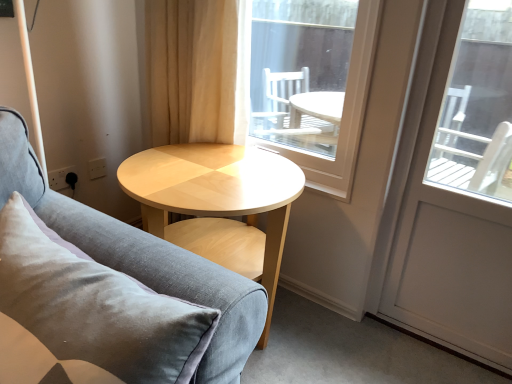
What do you see at coordinates (141, 257) in the screenshot? This screenshot has height=384, width=512. I see `velvet grey couch at center` at bounding box center [141, 257].

Locate an element on the screen. Image resolution: width=512 pixels, height=384 pixels. velvet grey couch at center is located at coordinates (141, 257).

The width and height of the screenshot is (512, 384). What do you see at coordinates (219, 201) in the screenshot?
I see `light wood/texture coffee table at center` at bounding box center [219, 201].

What do you see at coordinates (453, 190) in the screenshot? This screenshot has width=512, height=384. I see `white glossy screen door at right` at bounding box center [453, 190].

What is the approximate height of transparent glass window at center?

The height of transparent glass window at center is 71.34 centimeters.

This screenshot has height=384, width=512. I want to click on velvet grey couch at center, so click(141, 257).

Does beige fabric curtain at upper center have a lesser height compared to white glossy screen door at right?

Yes, beige fabric curtain at upper center is shorter than white glossy screen door at right.

Does beige fabric curtain at upper center touch white glossy screen door at right?

There is a gap between beige fabric curtain at upper center and white glossy screen door at right.

Is beige fabric curtain at upper center inside or outside of white glossy screen door at right?

beige fabric curtain at upper center is located beyond the bounds of white glossy screen door at right.

Does transparent glass window at center appear on the left side of light wood/texture coffee table at center?

Incorrect, transparent glass window at center is not on the left side of light wood/texture coffee table at center.

Is transparent glass window at center not close to light wood/texture coffee table at center?

That's not correct — transparent glass window at center is a little close to light wood/texture coffee table at center.

I want to click on coffee table below the transparent glass window at center (from a real-world perspective), so 219,201.

Would you say light wood/texture coffee table at center is part of transparent glass window at center's contents?

No, light wood/texture coffee table at center is not inside transparent glass window at center.

Between light wood/texture coffee table at center and transparent glass window at center, which one has larger width?

light wood/texture coffee table at center is wider.

Is the position of light wood/texture coffee table at center less distant than that of transparent glass window at center?

Yes, it is.

Is light wood/texture coffee table at center bigger than transparent glass window at center?

Yes.

Is transparent glass window at center to the left of beige fabric curtain at upper center from the viewer's perspective?

In fact, transparent glass window at center is to the right of beige fabric curtain at upper center.

From a real-world perspective, is transparent glass window at center on beige fabric curtain at upper center?

Actually, transparent glass window at center is physically below beige fabric curtain at upper center in the real world.

Is transparent glass window at center taller or shorter than beige fabric curtain at upper center?

In the image, transparent glass window at center appears to be taller than beige fabric curtain at upper center.

Is point (268, 12) in front of point (214, 19)?

No, it is not.

Is the surface of white glossy screen door at right in direct contact with velvet grey couch at center?

They are not placed beside each other.

In the scene shown: Between white glossy screen door at right and velvet grey couch at center, which one has more height?

white glossy screen door at right is taller.

From the image's perspective, is white glossy screen door at right above or below velvet grey couch at center?

Based on their image positions, white glossy screen door at right is located above velvet grey couch at center.

Identify the location of screen door above the velvet grey couch at center (from a real-world perspective). (453, 190).

Consider the image. How many degrees apart are the facing directions of light wood/texture coffee table at center and white glossy screen door at right?

The angle between the facing direction of light wood/texture coffee table at center and the facing direction of white glossy screen door at right is 91.7 degrees.

Which of these two, light wood/texture coffee table at center or white glossy screen door at right, stands taller?

white glossy screen door at right.

Looking at this image, does light wood/texture coffee table at center have a greater width compared to white glossy screen door at right?

Yes.

From the image's perspective, is light wood/texture coffee table at center under white glossy screen door at right?

Indeed, from the image's perspective, light wood/texture coffee table at center is shown beneath white glossy screen door at right.

Is light wood/texture coffee table at center surrounding velvet grey couch at center?

No, velvet grey couch at center is not inside light wood/texture coffee table at center.

Image resolution: width=512 pixels, height=384 pixels. In order to click on coffee table behind the velvet grey couch at center in this screenshot , I will do `click(219, 201)`.

Considering the positions of objects light wood/texture coffee table at center and velvet grey couch at center in the image provided, who is more to the right, light wood/texture coffee table at center or velvet grey couch at center?

From the viewer's perspective, light wood/texture coffee table at center appears more on the right side.

Locate an element on the screen. The image size is (512, 384). curtain that is above the white glossy screen door at right (from a real-world perspective) is located at coordinates (191, 70).

Identify the location of window above the light wood/texture coffee table at center (from the image's perspective). (309, 83).

Looking at the image, which one is located closer to light wood/texture coffee table at center, beige fabric curtain at upper center or velvet grey couch at center?

beige fabric curtain at upper center is closer to light wood/texture coffee table at center.

Based on their spatial positions, is light wood/texture coffee table at center or transparent glass window at center further from white glossy screen door at right?

light wood/texture coffee table at center is positioned further to the anchor white glossy screen door at right.

When comparing their distances from transparent glass window at center, does velvet grey couch at center or light wood/texture coffee table at center seem closer?

light wood/texture coffee table at center is positioned closer to the anchor transparent glass window at center.

Based on their spatial positions, is light wood/texture coffee table at center or white glossy screen door at right closer to velvet grey couch at center?

light wood/texture coffee table at center.

When comparing their distances from transparent glass window at center, does white glossy screen door at right or light wood/texture coffee table at center seem closer?

light wood/texture coffee table at center is positioned closer to the anchor transparent glass window at center.

When comparing their distances from velvet grey couch at center, does light wood/texture coffee table at center or beige fabric curtain at upper center seem closer?

Based on the image, light wood/texture coffee table at center appears to be nearer to velvet grey couch at center.

Considering their positions, is beige fabric curtain at upper center positioned closer to light wood/texture coffee table at center than white glossy screen door at right?

beige fabric curtain at upper center is closer to light wood/texture coffee table at center.

When comparing their distances from beige fabric curtain at upper center, does white glossy screen door at right or light wood/texture coffee table at center seem closer?

Based on the image, light wood/texture coffee table at center appears to be nearer to beige fabric curtain at upper center.

Identify the location of window between velvet grey couch at center and white glossy screen door at right. (309, 83).

This screenshot has height=384, width=512. What are the coordinates of `window situated between light wood/texture coffee table at center and white glossy screen door at right from left to right` in the screenshot? It's located at (309, 83).

This screenshot has width=512, height=384. What are the coordinates of `window between beige fabric curtain at upper center and white glossy screen door at right` in the screenshot? It's located at (309, 83).

You are a GUI agent. You are given a task and a screenshot of the screen. Output one action in this format:
    pyautogui.click(x=<x>, y=<y>)
    Task: Click on the window positioned between velvet grey couch at center and beige fabric curtain at upper center from near to far
    
    Given the screenshot: What is the action you would take?
    pyautogui.click(x=309, y=83)